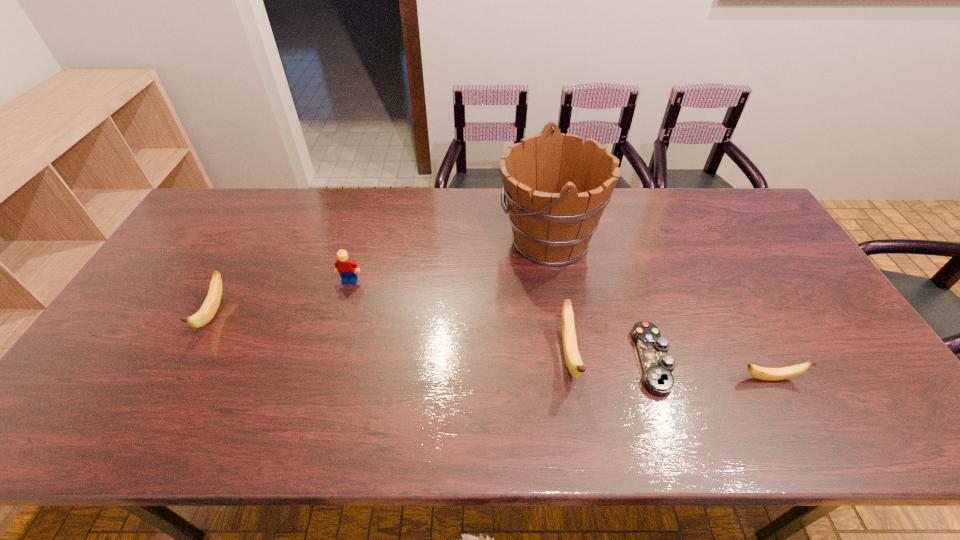
Locate an element on the screen. This screenshot has width=960, height=540. free space that satisfies the following two spatial constraints: 1. with the handle on the tallest object; 2. at the stem of the leftmost object is located at coordinates (561, 314).

Image resolution: width=960 pixels, height=540 pixels. I want to click on vacant space that satisfies the following two spatial constraints: 1. with the handle on the tallest object; 2. on the left side of the fifth object from left to right, so click(568, 360).

The image size is (960, 540). Identify the location of free spot that satisfies the following two spatial constraints: 1. on the front-facing side of the Lego; 2. on the left side of the shortest object. (327, 360).